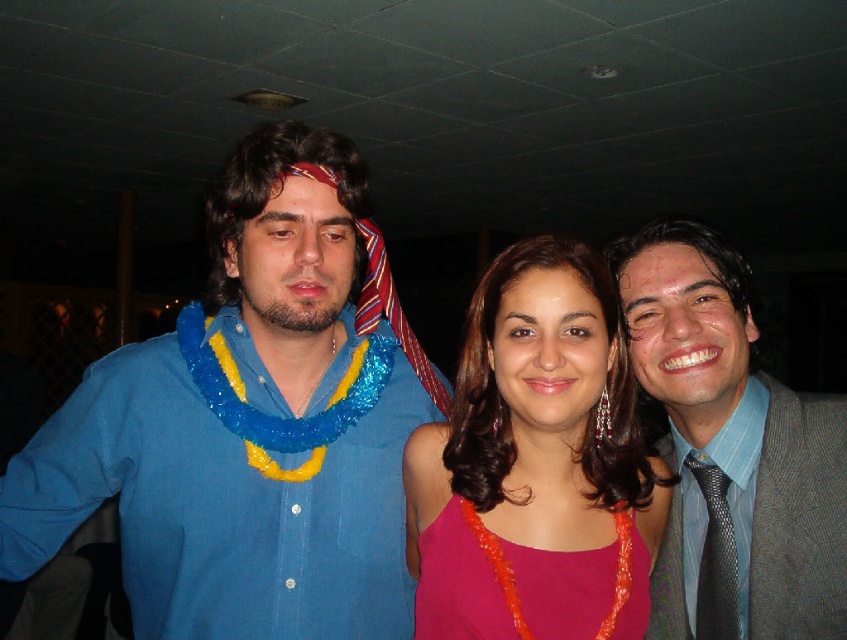
You are at a party and want to take a photo of the blue fabric shirt at left and the black textured tie at right. Which one will appear larger in the photo?

The blue fabric shirt at left will appear larger in the photo because it is closer to the viewer than the black textured tie at right.

You are a photographer at a party and want to take a photo of the gray textured suit at right and the shiny pink fabric dress at center. Which one is closer to you?

The gray textured suit at right is closer to you than the shiny pink fabric dress at center.

You are at a party and want to find the shortest clothing item among the pink fabric dress at center and the gray textured suit at right. Which one should you look for?

The pink fabric dress at center is shorter than the gray textured suit at right, so you should look for the pink fabric dress at center.